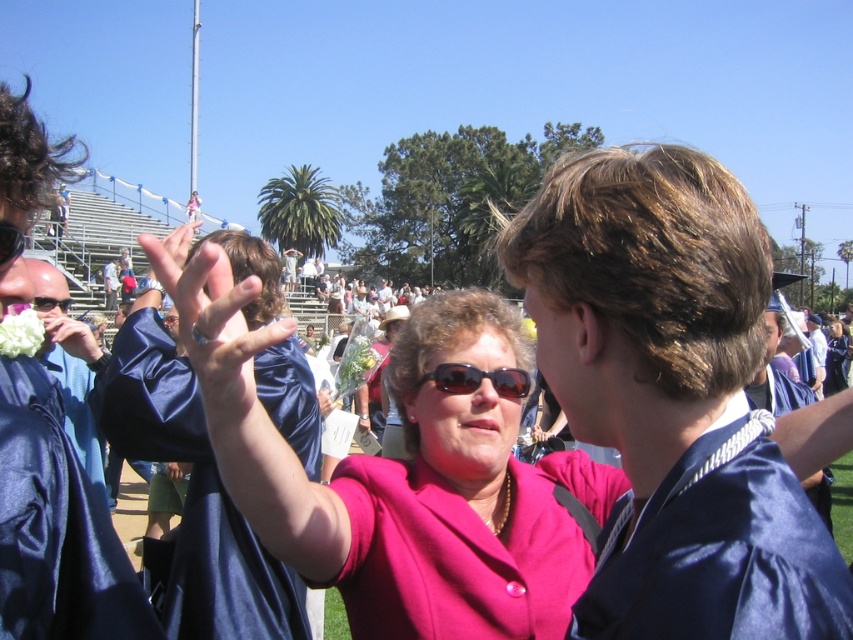
Is pink satin jacket at center bigger than black plastic sunglasses at center?

Correct, pink satin jacket at center is larger in size than black plastic sunglasses at center.

Between point (437, 305) and point (527, 388), which one is positioned behind?

The point (437, 305) is more distant.

Measure the distance between pink satin jacket at center and camera.

A distance of 10.99 feet exists between pink satin jacket at center and camera.

Identify the location of pink satin jacket at center. The width and height of the screenshot is (853, 640). (380, 486).

Does black plastic sunglasses at center have a greater height compared to white fluffy flower at center?

No.

Who is positioned more to the right, black plastic sunglasses at center or white fluffy flower at center?

From the viewer's perspective, black plastic sunglasses at center appears more on the right side.

This screenshot has height=640, width=853. Describe the element at coordinates (477, 380) in the screenshot. I see `black plastic sunglasses at center` at that location.

Find the location of `black plastic sunglasses at center`. black plastic sunglasses at center is located at coordinates (477, 380).

Who is more forward, (518, 406) or (18, 355)?

Positioned in front is point (518, 406).

Find the location of `pink satin jacket at center`. pink satin jacket at center is located at coordinates (380, 486).